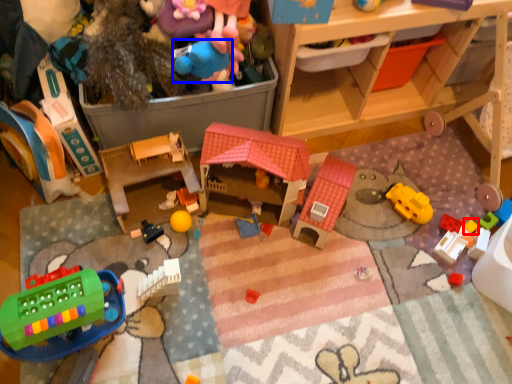
Question: Which of the following is the farthest to the observer, toy (highlighted by a red box) or toy (highlighted by a blue box)?

Choices:
 (A) toy
 (B) toy

Answer: (A)